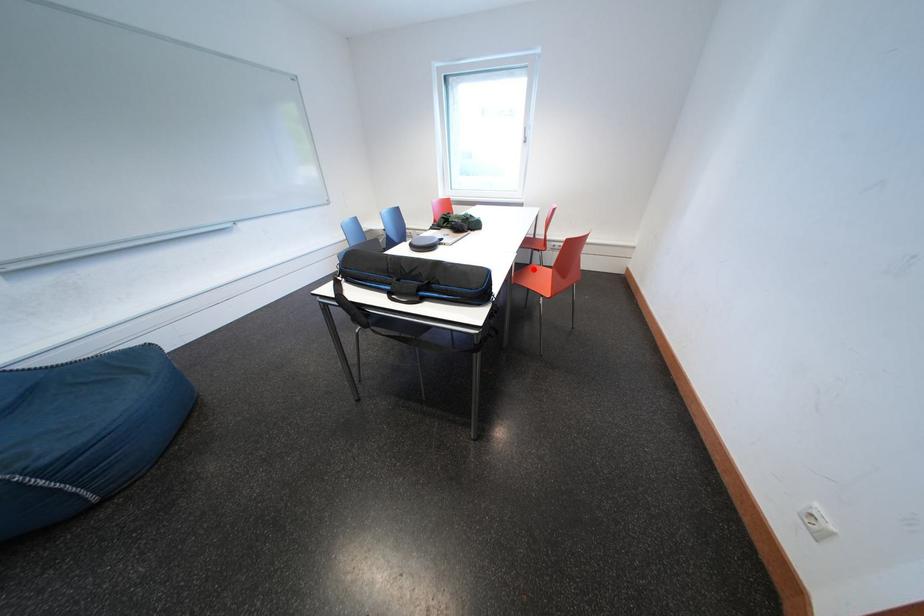
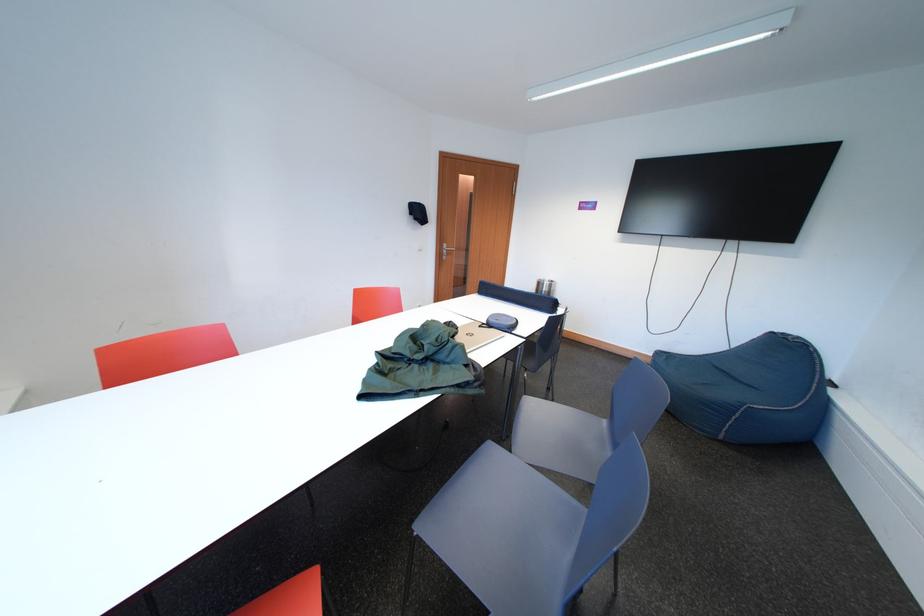
Question: I am providing you with two images of the same scene from different viewpoints. A red point is marked on the first image. Is the red point's position out of view in image 2?

Choices:
 (A) Yes
 (B) No

Answer: (A)